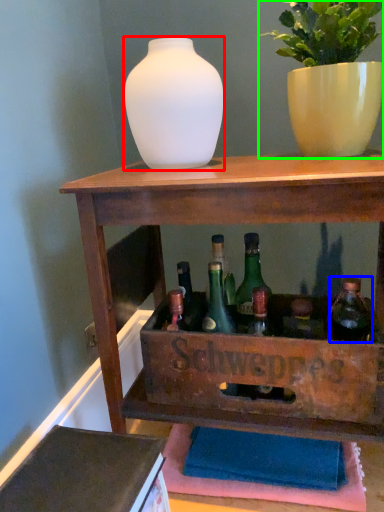
Question: Based on their relative distances, which object is nearer to vase (highlighted by a red box)? Choose from bottle (highlighted by a blue box) and houseplant (highlighted by a green box).

Choices:
 (A) bottle
 (B) houseplant

Answer: (B)